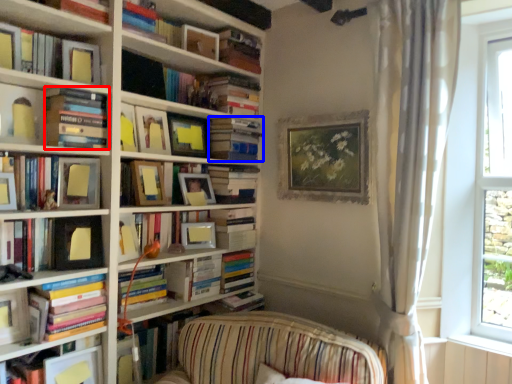
Question: Which object is further to the camera taking this photo, book (highlighted by a red box) or book (highlighted by a blue box)?

Choices:
 (A) book
 (B) book

Answer: (B)